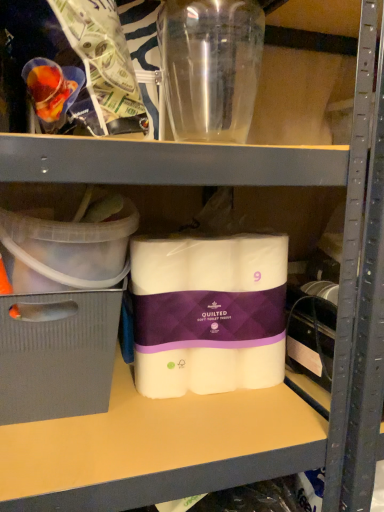
What are the coordinates of `gray cardboard box at left, which is counted as the 1th storage box, starting from the bottom` in the screenshot? It's located at (57, 354).

This screenshot has width=384, height=512. Describe the element at coordinates (57, 354) in the screenshot. I see `gray cardboard box at left, which is counted as the 1th storage box, starting from the bottom` at that location.

Describe the element at coordinates (64, 237) in the screenshot. I see `clear plastic container at left, the 2th storage box positioned from the bottom` at that location.

Locate an element on the screen. Image resolution: width=384 pixels, height=512 pixels. transparent plastic bottle at upper center is located at coordinates (210, 66).

From a real-world perspective, is clear plastic container at left, acting as the first storage box starting from the top, on white quilted toilet paper at center?

Indeed, from a real-world perspective, clear plastic container at left, acting as the first storage box starting from the top, stands above white quilted toilet paper at center.

Is clear plastic container at left, acting as the first storage box starting from the top, oriented away from white quilted toilet paper at center?

No, clear plastic container at left, acting as the first storage box starting from the top, is not facing the opposite direction of white quilted toilet paper at center.

Considering the relative positions of clear plastic container at left, the 2th storage box positioned from the bottom, and white quilted toilet paper at center in the image provided, is clear plastic container at left, the 2th storage box positioned from the bottom, behind white quilted toilet paper at center?

No, it is not.

From the image's perspective, is clear plastic container at left, acting as the first storage box starting from the top, above transparent plastic bottle at upper center?

No, from the image's perspective, clear plastic container at left, acting as the first storage box starting from the top, is not on top of transparent plastic bottle at upper center.

From a real-world perspective, which object stands above the other?

From a 3D spatial view, transparent plastic bottle at upper center is above.

Can you confirm if clear plastic container at left, the 2th storage box positioned from the bottom, is taller than transparent plastic bottle at upper center?

No, clear plastic container at left, the 2th storage box positioned from the bottom, is not taller than transparent plastic bottle at upper center.

Locate an element on the screen. bottle on the right of clear plastic container at left, acting as the first storage box starting from the top is located at coordinates (210, 66).

Is point (39, 257) positioned behind point (0, 402)?

No, it is in front of (0, 402).

Is the position of clear plastic container at left, the 2th storage box positioned from the bottom, less distant than that of gray cardboard box at left, the 2th storage box viewed from the top?

Yes, clear plastic container at left, the 2th storage box positioned from the bottom, is closer to the viewer.

Based on their positions, is clear plastic container at left, acting as the first storage box starting from the top, located to the left or right of gray cardboard box at left, which is counted as the 1th storage box, starting from the bottom?

Clearly, clear plastic container at left, acting as the first storage box starting from the top, is on the right of gray cardboard box at left, which is counted as the 1th storage box, starting from the bottom, in the image.

From the image's perspective, between clear plastic container at left, the 2th storage box positioned from the bottom, and gray cardboard box at left, which is counted as the 1th storage box, starting from the bottom, which one is located above?

clear plastic container at left, the 2th storage box positioned from the bottom, from the image's perspective.

Does white quilted toilet paper at center have a larger size compared to gray cardboard box at left, which is counted as the 1th storage box, starting from the bottom?

Actually, white quilted toilet paper at center might be smaller than gray cardboard box at left, which is counted as the 1th storage box, starting from the bottom.

Can you confirm if white quilted toilet paper at center is shorter than gray cardboard box at left, the 2th storage box viewed from the top?

No.

Which of these two, white quilted toilet paper at center or gray cardboard box at left, the 2th storage box viewed from the top, is wider?

gray cardboard box at left, the 2th storage box viewed from the top, is wider.

Looking at this image, which object is positioned more to the right, white quilted toilet paper at center or gray cardboard box at left, the 2th storage box viewed from the top?

From the viewer's perspective, white quilted toilet paper at center appears more on the right side.

Could you measure the distance between white quilted toilet paper at center and transparent plastic bottle at upper center?

white quilted toilet paper at center and transparent plastic bottle at upper center are 55.53 centimeters apart from each other.

Is point (239, 290) positioned before point (245, 116)?

Yes, it is.

Can you confirm if white quilted toilet paper at center is positioned to the right of transparent plastic bottle at upper center?

No.

Which of these two, white quilted toilet paper at center or transparent plastic bottle at upper center, is thinner?

With smaller width is white quilted toilet paper at center.

You are a GUI agent. You are given a task and a screenshot of the screen. Output one action in this format:
    pyautogui.click(x=<x>, y=<y>)
    Task: Click on the toilet paper beneath the clear plastic container at left, acting as the first storage box starting from the top (from a real-world perspective)
    The image size is (384, 512).
    Given the screenshot: What is the action you would take?
    pyautogui.click(x=209, y=314)

From the image's perspective, is white quilted toilet paper at center located above clear plastic container at left, acting as the first storage box starting from the top?

No.

Is white quilted toilet paper at center directly adjacent to clear plastic container at left, acting as the first storage box starting from the top?

No.

Can you confirm if white quilted toilet paper at center is bigger than clear plastic container at left, the 2th storage box positioned from the bottom?

No.

Is transparent plastic bottle at upper center positioned far away from white quilted toilet paper at center?

No, transparent plastic bottle at upper center is not far away from white quilted toilet paper at center.

Is white quilted toilet paper at center located within transparent plastic bottle at upper center?

No, white quilted toilet paper at center is not a part of transparent plastic bottle at upper center.

Considering the positions of points (183, 125) and (279, 301), is point (183, 125) closer to camera compared to point (279, 301)?

No, (183, 125) is behind (279, 301).

What are the coordinates of `toilet paper that is below the clear plastic container at left, acting as the first storage box starting from the top (from the image's perspective)` in the screenshot? It's located at (209, 314).

This screenshot has width=384, height=512. I want to click on storage box lying in front of the transparent plastic bottle at upper center, so click(x=64, y=237).

Looking at the image, which one is located closer to clear plastic container at left, acting as the first storage box starting from the top, gray cardboard box at left, which is counted as the 1th storage box, starting from the bottom, or white quilted toilet paper at center?

Among the two, gray cardboard box at left, which is counted as the 1th storage box, starting from the bottom, is located nearer to clear plastic container at left, acting as the first storage box starting from the top.

Looking at the image, which one is located closer to transparent plastic bottle at upper center, gray cardboard box at left, the 2th storage box viewed from the top, or white quilted toilet paper at center?

white quilted toilet paper at center lies closer to transparent plastic bottle at upper center than the other object.

Considering their positions, is clear plastic container at left, the 2th storage box positioned from the bottom, positioned further to white quilted toilet paper at center than gray cardboard box at left, the 2th storage box viewed from the top?

clear plastic container at left, the 2th storage box positioned from the bottom, is positioned further to the anchor white quilted toilet paper at center.

From the picture: When comparing their distances from transparent plastic bottle at upper center, does white quilted toilet paper at center or clear plastic container at left, the 2th storage box positioned from the bottom, seem closer?

The object closer to transparent plastic bottle at upper center is clear plastic container at left, the 2th storage box positioned from the bottom.

When comparing their distances from clear plastic container at left, acting as the first storage box starting from the top, does transparent plastic bottle at upper center or gray cardboard box at left, which is counted as the 1th storage box, starting from the bottom, seem further?

transparent plastic bottle at upper center.

Looking at the image, which one is located further to white quilted toilet paper at center, transparent plastic bottle at upper center or gray cardboard box at left, the 2th storage box viewed from the top?

Based on the image, transparent plastic bottle at upper center appears to be further to white quilted toilet paper at center.

Based on their spatial positions, is gray cardboard box at left, the 2th storage box viewed from the top, or transparent plastic bottle at upper center closer to white quilted toilet paper at center?

Based on the image, gray cardboard box at left, the 2th storage box viewed from the top, appears to be nearer to white quilted toilet paper at center.

Estimate the real-world distances between objects in this image. Which object is further from clear plastic container at left, the 2th storage box positioned from the bottom, gray cardboard box at left, which is counted as the 1th storage box, starting from the bottom, or transparent plastic bottle at upper center?

transparent plastic bottle at upper center is further to clear plastic container at left, the 2th storage box positioned from the bottom.

What are the coordinates of `storage box between transparent plastic bottle at upper center and white quilted toilet paper at center from top to bottom` in the screenshot? It's located at (64, 237).

The image size is (384, 512). In order to click on toilet paper between transparent plastic bottle at upper center and gray cardboard box at left, the 2th storage box viewed from the top, from top to bottom in this screenshot , I will do `click(209, 314)`.

The width and height of the screenshot is (384, 512). Identify the location of storage box that lies between transparent plastic bottle at upper center and gray cardboard box at left, the 2th storage box viewed from the top, from top to bottom. (64, 237).

The width and height of the screenshot is (384, 512). I want to click on storage box situated between gray cardboard box at left, which is counted as the 1th storage box, starting from the bottom, and white quilted toilet paper at center from left to right, so click(64, 237).